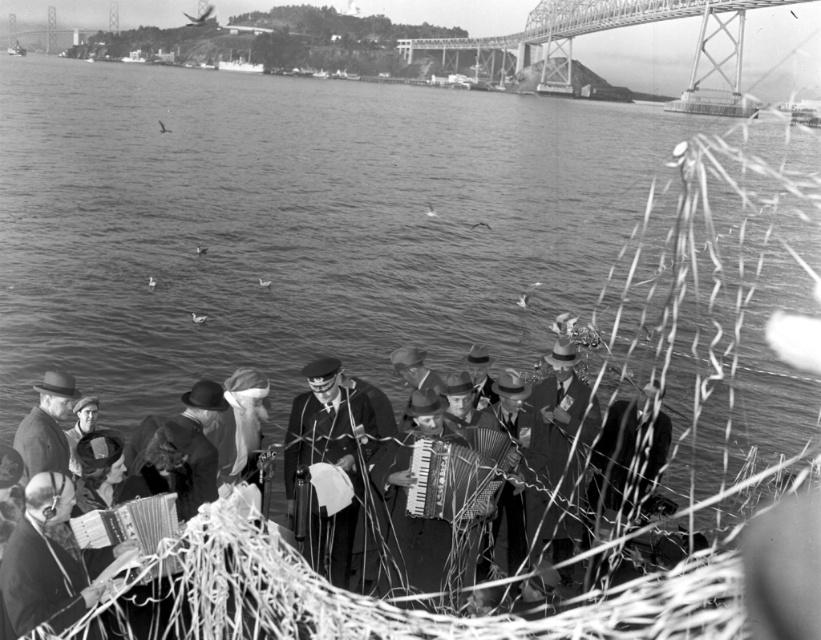
Question: Considering the real-world distances, which object is farthest from the smooth leather hat at center?

Choices:
 (A) metallic silver accordion at lower left
 (B) smooth fabric coat at center

Answer: (A)

Question: In this image, where is metallic steel bridge at upper center located relative to metallic silver accordion at lower left?

Choices:
 (A) right
 (B) left

Answer: (A)

Question: Among these points, which one is farthest from the camera?

Choices:
 (A) (167, 563)
 (B) (333, 397)
 (C) (565, 547)
 (D) (494, 435)

Answer: (B)

Question: Does smooth leather hat at center appear over smooth brown hat at center?

Choices:
 (A) yes
 (B) no

Answer: (B)

Question: Estimate the real-world distances between objects in this image. Which object is closer to the metallic silver accordion at lower left?

Choices:
 (A) smooth fabric coat at center
 (B) smooth leather hat at center
 (C) metallic accordion at center
 (D) metallic steel bridge at upper center

Answer: (A)

Question: Is smooth leather hat at center below smooth brown hat at center?

Choices:
 (A) yes
 (B) no

Answer: (A)